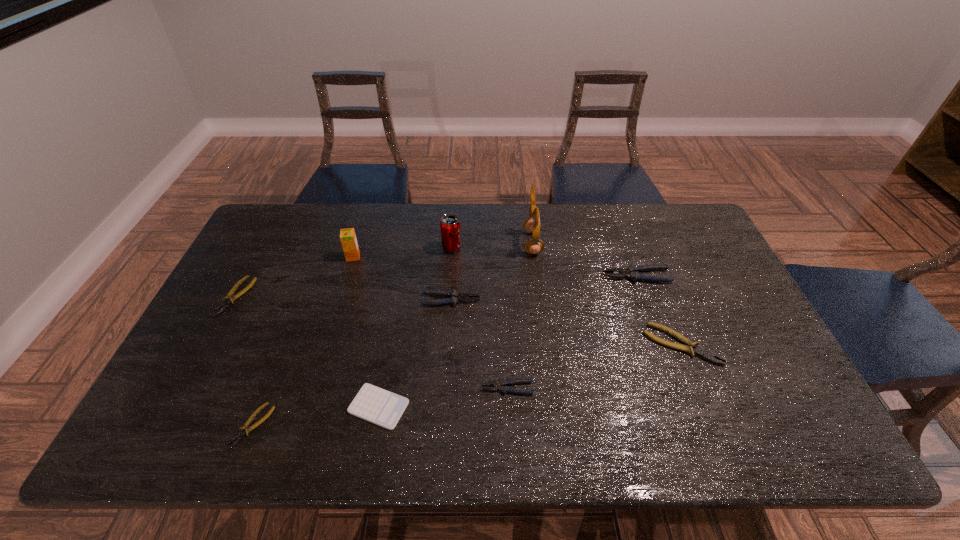
Identify the location of vacant region located on the front-facing side of the brown earphone. The width and height of the screenshot is (960, 540). (485, 243).

The width and height of the screenshot is (960, 540). I want to click on vacant area situated on the back of the red soda can, so click(x=454, y=213).

At what (x,y) coordinates should I click in order to perform the action: click on vacant region located on the left of the eighth object from right to left. Please return your answer as a coordinate pair (x, y). Image resolution: width=960 pixels, height=540 pixels. Looking at the image, I should click on (277, 256).

Identify the location of free space located 0.260m at the gripping part of the seventh shortest object. The width and height of the screenshot is (960, 540). (518, 276).

Find the location of a particular element. This screenshot has height=540, width=960. vacant space situated 0.370m at the gripping part of the seventh shortest object is located at coordinates (483, 276).

You are a GUI agent. You are given a task and a screenshot of the screen. Output one action in this format:
    pyautogui.click(x=<x>, y=<y>)
    Task: Click on the free region located 0.080m at the gripping part of the seventh shortest object
    The width and height of the screenshot is (960, 540).
    Given the screenshot: What is the action you would take?
    pyautogui.click(x=577, y=276)

Where is `vacant position located 0.140m at the gripping part of the third pliers from left to right`? This screenshot has height=540, width=960. vacant position located 0.140m at the gripping part of the third pliers from left to right is located at coordinates (527, 300).

I want to click on vacant position located on the back of the fourth nearest object, so click(x=645, y=252).

Identify the location of free spot located at the gripping part of the smallest gray pliers. This screenshot has height=540, width=960. click(352, 388).

Find the location of `free location located 0.130m at the gripping part of the smallest gray pliers`. free location located 0.130m at the gripping part of the smallest gray pliers is located at coordinates [429, 388].